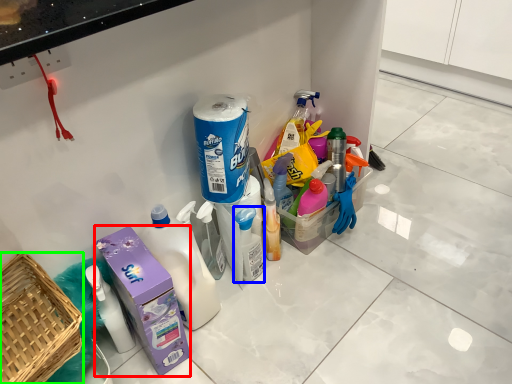
Question: Which object is positioned farthest from carton (highlighted by a red box)? Select from cleaning product (highlighted by a blue box) and basket (highlighted by a green box).

Choices:
 (A) cleaning product
 (B) basket

Answer: (A)